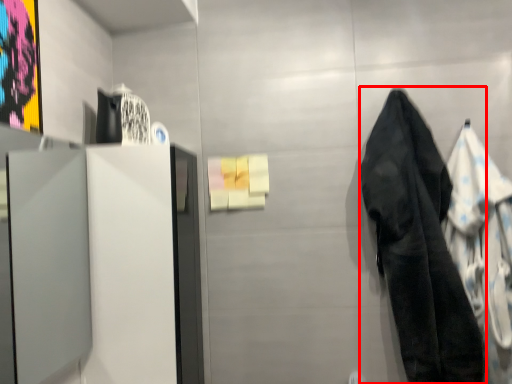
Question: From the image's perspective, where is towel/napkin (annotated by the red box) located in relation to cloak in the image?

Choices:
 (A) above
 (B) below

Answer: (A)